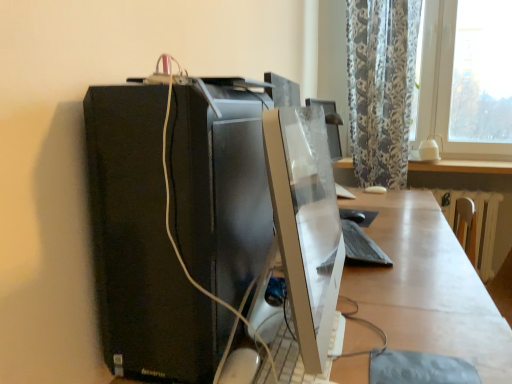
You are a GUI agent. You are given a task and a screenshot of the screen. Output one action in this format:
    pyautogui.click(x=<x>, y=<y>)
    Task: Click on the vacant area located to the right-hand side of black matte keyboard at center
    
    Given the screenshot: What is the action you would take?
    pyautogui.click(x=408, y=238)